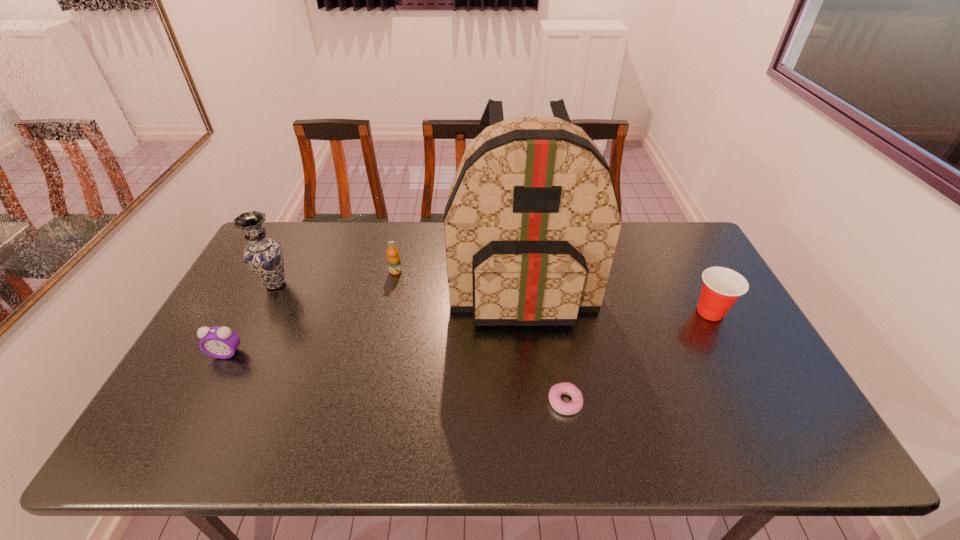
Where is `blank region between the fifth shortest object and the backpack`? The image size is (960, 540). blank region between the fifth shortest object and the backpack is located at coordinates (398, 282).

Locate an element on the screen. free space between the shortest object and the fifth shortest object is located at coordinates (420, 343).

You are a GUI agent. You are given a task and a screenshot of the screen. Output one action in this format:
    pyautogui.click(x=<x>, y=<y>)
    Task: Click on the free area in between the vase and the shortest object
    This screenshot has width=960, height=540.
    Given the screenshot: What is the action you would take?
    pyautogui.click(x=420, y=343)

Find the location of `object that is the third closest to the alarm clock`. object that is the third closest to the alarm clock is located at coordinates (532, 220).

The image size is (960, 540). Identify the location of object identified as the closest to the pastry. (532, 220).

At what (x,y) coordinates should I click in order to perform the action: click on vacant region that satisfies the following two spatial constraints: 1. on the label of the pastry; 2. on the left side of the orange juice. Please return your answer as a coordinate pair (x, y). The image size is (960, 540). Looking at the image, I should click on tap(368, 402).

I want to click on vacant area in the image that satisfies the following two spatial constraints: 1. on the face of the alarm clock; 2. on the right side of the pastry, so click(x=201, y=402).

Find the location of a particular element. The height and width of the screenshot is (540, 960). blank space that satisfies the following two spatial constraints: 1. on the face of the pastry; 2. on the right side of the second shortest object is located at coordinates pos(201,402).

Locate an element on the screen. vacant region that satisfies the following two spatial constraints: 1. on the front face of the backpack; 2. on the left side of the shortest object is located at coordinates (534, 402).